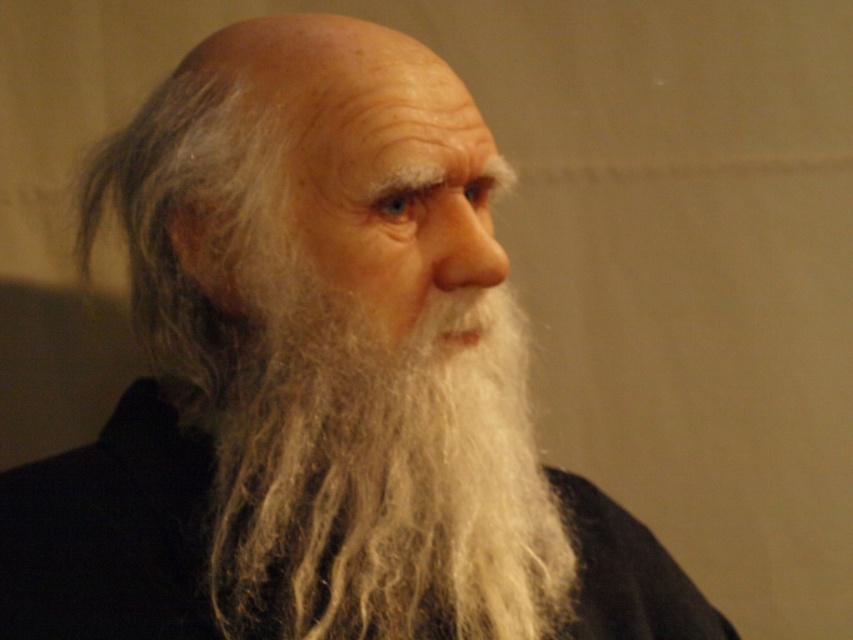
You are a tailor measuring the distance between the white woolen beard at center and the silky black robe at center for a costume design. Can you fit a 5 inch wide decorative ribbon between them?

The distance between the white woolen beard at center and the silky black robe at center is 5.11 inches. Since the ribbon is 5 inches wide, it can fit between them with a small gap remaining.

You are an artist trying to sketch the white woolen beard at center based on the image. To ensure accuracy, where should you place the center point of the beard in your drawing using a coordinate system where the bottom left corner is the origin?

The center point of the white woolen beard at center should be placed at coordinates approximately 0.742 on the x axis and 0.447 on the y axis in the coordinate system provided.

You are a photographer adjusting the focus of your camera. You want to capture a clear image of both the white woolen beard at center and the silky black robe at center. Since the camera can only focus on one object at a time, which object should you focus on to ensure the closer one is sharp?

The white woolen beard at center is closer to the viewer than the silky black robe at center. Therefore, you should focus on the white woolen beard at center to ensure the closer object is in sharp focus.